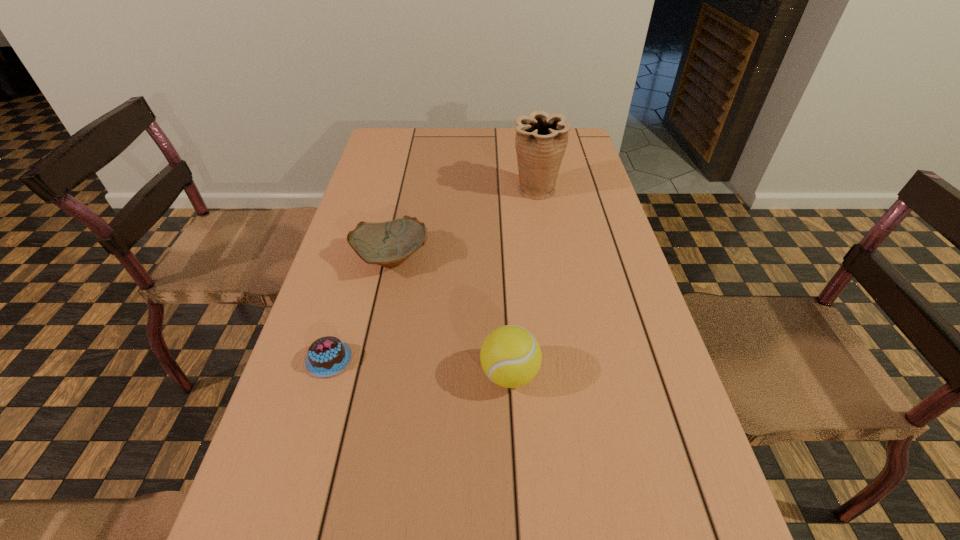
The height and width of the screenshot is (540, 960). In order to click on vacant space that satisfies the following two spatial constraints: 1. on the front side of the chocolate cake; 2. on the left side of the tennis ball in this screenshot , I will do `click(324, 374)`.